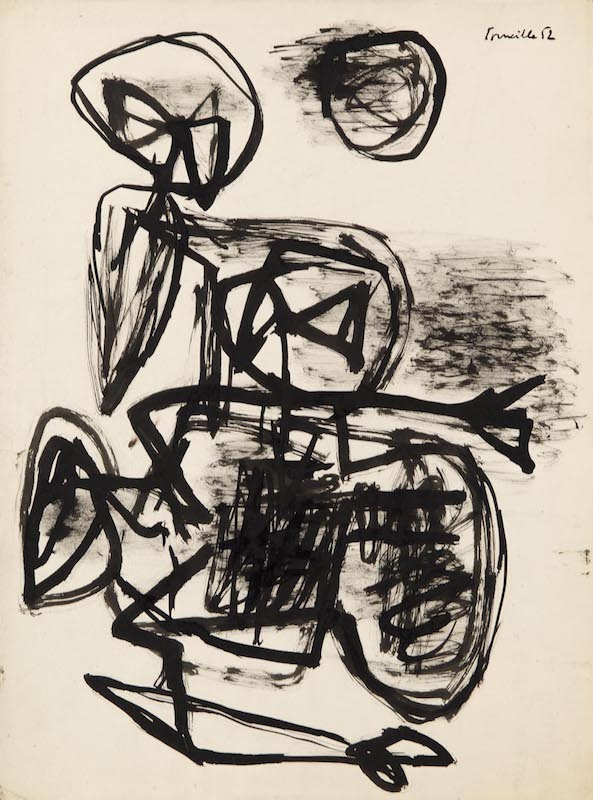
Find the location of `black marker`. black marker is located at coordinates (159, 640).